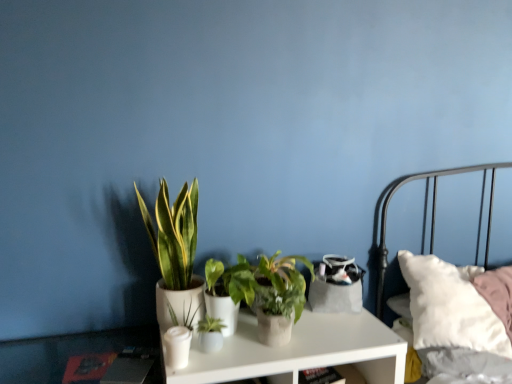
Question: Does green matte plant at center, the 2th houseplant when ordered from left to right, have a larger size compared to green matte plant at center, which is counted as the first houseplant, starting from the right?

Choices:
 (A) no
 (B) yes

Answer: (A)

Question: Is green matte plant at center, the 2th houseplant when ordered from left to right, at the right side of green matte plant at center, which is counted as the first houseplant, starting from the right?

Choices:
 (A) no
 (B) yes

Answer: (A)

Question: Considering the relative positions of green matte plant at center, which ranks as the 3th houseplant in right-to-left order, and green matte plant at center, which is the 4th houseplant from left to right, in the image provided, is green matte plant at center, which ranks as the 3th houseplant in right-to-left order, to the left of green matte plant at center, which is the 4th houseplant from left to right, from the viewer's perspective?

Choices:
 (A) yes
 (B) no

Answer: (A)

Question: From the image's perspective, would you say green matte plant at center, the 2th houseplant when ordered from left to right, is shown under green matte plant at center, which is counted as the first houseplant, starting from the right?

Choices:
 (A) yes
 (B) no

Answer: (A)

Question: Does green matte plant at center, the 2th houseplant when ordered from left to right, have a lesser width compared to green matte plant at center, which is the 4th houseplant from left to right?

Choices:
 (A) yes
 (B) no

Answer: (A)

Question: In terms of height, does white matte nightstand at center look taller or shorter compared to green matte plant at center, the 3th houseplant viewed from the left?

Choices:
 (A) short
 (B) tall

Answer: (B)

Question: In terms of width, does white matte nightstand at center look wider or thinner when compared to green matte plant at center, the 2th houseplant in the right-to-left sequence?

Choices:
 (A) thin
 (B) wide

Answer: (B)

Question: Relative to green matte plant at center, the 2th houseplant in the right-to-left sequence, is white matte nightstand at center in front or behind?

Choices:
 (A) behind
 (B) front

Answer: (B)

Question: Is white matte nightstand at center inside or outside of green matte plant at center, the 2th houseplant in the right-to-left sequence?

Choices:
 (A) inside
 (B) outside

Answer: (B)

Question: Is green glossy plant at center, which is the 4th houseplant in right-to-left order, wider or thinner than white matte nightstand at center?

Choices:
 (A) thin
 (B) wide

Answer: (A)

Question: From a real-world perspective, relative to white matte nightstand at center, is green glossy plant at center, which ranks as the first houseplant in left-to-right order, vertically above or below?

Choices:
 (A) above
 (B) below

Answer: (A)

Question: From the image's perspective, is green glossy plant at center, which ranks as the first houseplant in left-to-right order, positioned above or below white matte nightstand at center?

Choices:
 (A) above
 (B) below

Answer: (A)

Question: Is green glossy plant at center, which is the 4th houseplant in right-to-left order, taller or shorter than white matte nightstand at center?

Choices:
 (A) short
 (B) tall

Answer: (B)

Question: In terms of size, does green matte plant at center appear bigger or smaller than green matte plant at center, the 3th houseplant viewed from the left?

Choices:
 (A) big
 (B) small

Answer: (B)

Question: Is green matte plant at center taller or shorter than green matte plant at center, the 3th houseplant viewed from the left?

Choices:
 (A) tall
 (B) short

Answer: (B)